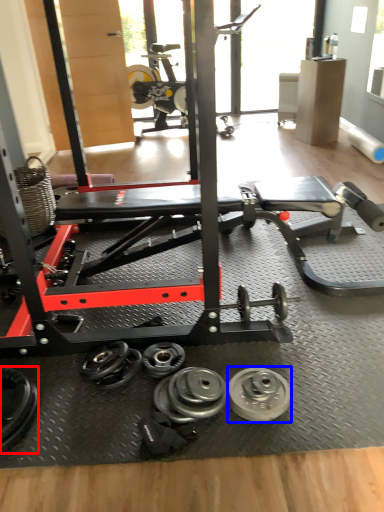
Question: Which point is further to the camera, dumbbell (highlighted by a red box) or wheel (highlighted by a blue box)?

Choices:
 (A) dumbbell
 (B) wheel

Answer: (B)